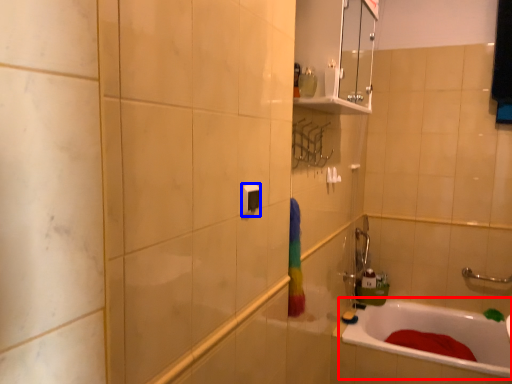
Question: Which object appears closest to the camera in this image, bathtub (highlighted by a red box) or light switch (highlighted by a blue box)?

Choices:
 (A) bathtub
 (B) light switch

Answer: (B)